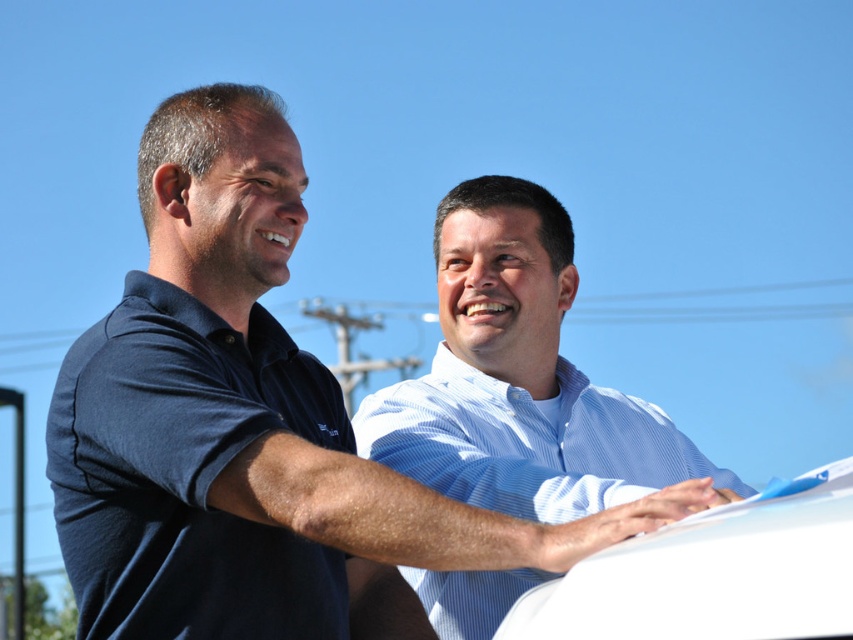
You are a photographer trying to capture both the blue cotton shirt at upper center and the white matte car at center in a single frame. Given their sizes, which object should you focus on to ensure both fit comfortably in the photo?

The blue cotton shirt at upper center is wider than the white matte car at center, so focusing on the blue cotton shirt at upper center will ensure both fit comfortably in the photo.

You are a photographer trying to capture a photo of the light blue striped shirt at center and the white matte car at center. Since you want to emphasize the shirt, which object should you position closer to the camera?

The light blue striped shirt at center has a larger size compared to the white matte car at center. To emphasize the shirt, you should position the light blue striped shirt at center closer to the camera since its actual size is bigger and placing it nearer will make it appear even more prominent in the photo.

You are a photographer trying to capture a wide shot of the light blue striped shirt at center and the white matte car at center. Given that the camera can only focus on objects within a 5 meter width, will both objects fit in the frame?

The light blue striped shirt at center is larger in width than the white matte car at center. However, without specific measurements, it is impossible to determine if both will fit within the 5 meter width constraint.